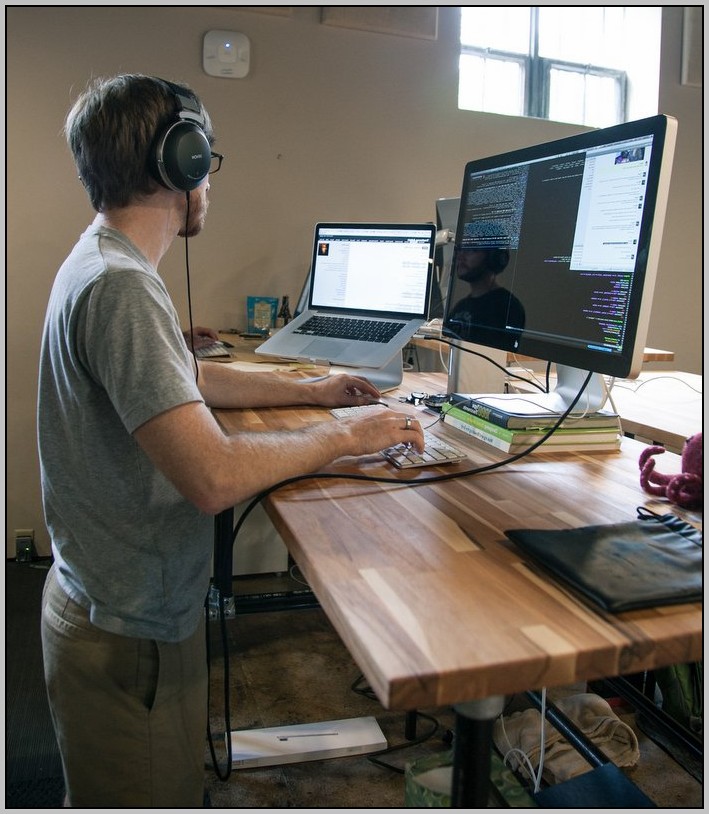
Find the location of `books`. books is located at coordinates (483, 439), (473, 422), (476, 407).